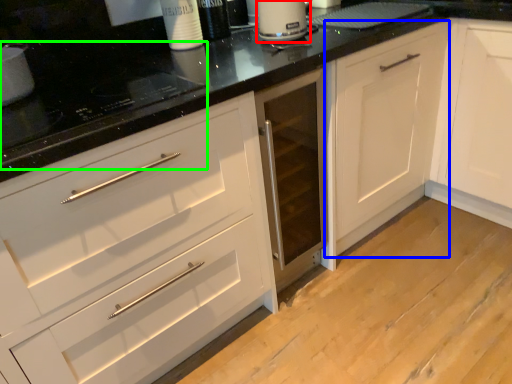
Question: Considering the real-world distances, which object is farthest from kitchen appliance (highlighted by a red box)? cabinetry (highlighted by a blue box) or appliance (highlighted by a green box)?

Choices:
 (A) cabinetry
 (B) appliance

Answer: (B)